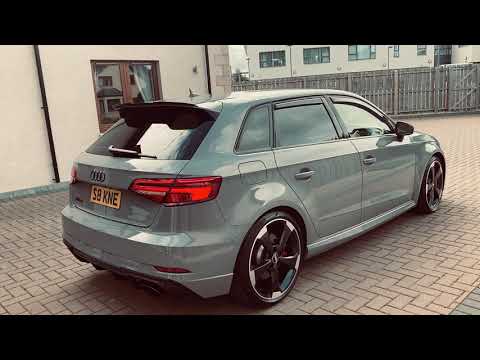
Locate an element on the screen. Image resolution: width=480 pixels, height=360 pixels. right mirror is located at coordinates (411, 126).